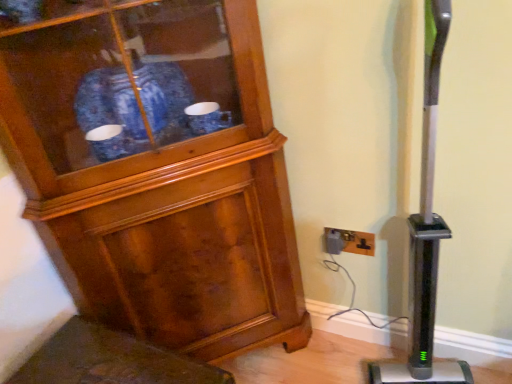
Question: Is wooden cabinet at left aimed at black plastic outlet at lower right?

Choices:
 (A) yes
 (B) no

Answer: (B)

Question: Is wooden cabinet at left shorter than black plastic outlet at lower right?

Choices:
 (A) yes
 (B) no

Answer: (B)

Question: Is wooden cabinet at left to the right of black plastic outlet at lower right from the viewer's perspective?

Choices:
 (A) yes
 (B) no

Answer: (B)

Question: Is wooden cabinet at left positioned far away from black plastic outlet at lower right?

Choices:
 (A) yes
 (B) no

Answer: (B)

Question: From a real-world perspective, is wooden cabinet at left physically above black plastic outlet at lower right?

Choices:
 (A) yes
 (B) no

Answer: (A)

Question: From the image's perspective, is wooden cabinet at left located beneath black plastic outlet at lower right?

Choices:
 (A) no
 (B) yes

Answer: (A)

Question: Does black plastic outlet at lower right have a greater height compared to wooden cabinet at left?

Choices:
 (A) yes
 (B) no

Answer: (B)

Question: Is black plastic outlet at lower right positioned in front of wooden cabinet at left?

Choices:
 (A) no
 (B) yes

Answer: (A)

Question: Does black plastic outlet at lower right have a greater width compared to wooden cabinet at left?

Choices:
 (A) no
 (B) yes

Answer: (A)

Question: Is black plastic outlet at lower right beside wooden cabinet at left?

Choices:
 (A) yes
 (B) no

Answer: (B)

Question: Is black plastic outlet at lower right smaller than wooden cabinet at left?

Choices:
 (A) no
 (B) yes

Answer: (B)

Question: From a real-world perspective, is black plastic outlet at lower right located beneath wooden cabinet at left?

Choices:
 (A) yes
 (B) no

Answer: (A)

Question: From their relative heights in the image, would you say wooden cabinet at left is taller or shorter than black plastic outlet at lower right?

Choices:
 (A) tall
 (B) short

Answer: (A)